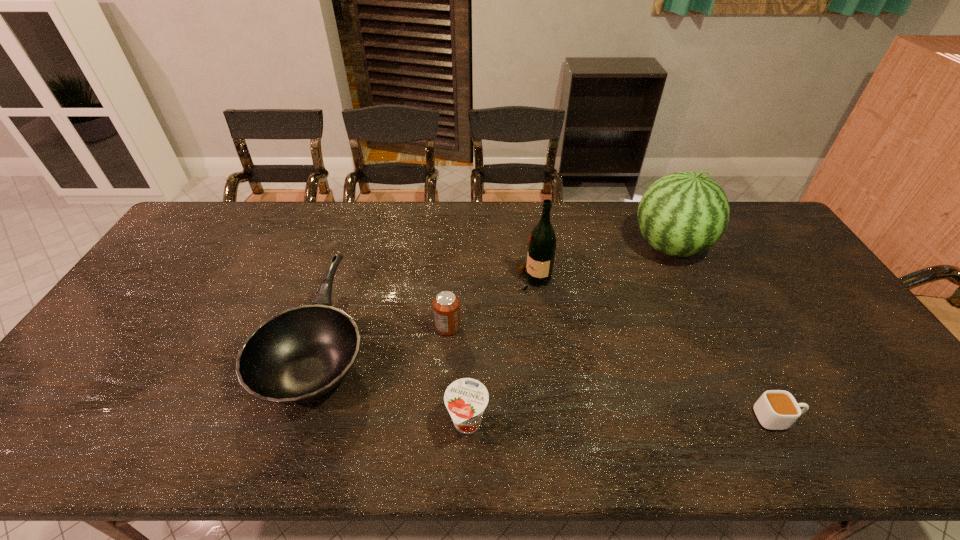
Where is `free space located on the front of the can`? This screenshot has width=960, height=540. free space located on the front of the can is located at coordinates (443, 403).

Locate an element on the screen. vacant space located on the left of the frying pan is located at coordinates (208, 341).

You are a GUI agent. You are given a task and a screenshot of the screen. Output one action in this format:
    pyautogui.click(x=<x>, y=<y>)
    Task: Click on the blank space located 0.140m on the back of the yogurt
    The image size is (960, 540).
    Given the screenshot: What is the action you would take?
    pyautogui.click(x=468, y=355)

The height and width of the screenshot is (540, 960). Find the location of `vacant space located on the side with the handle of the shortest object`. vacant space located on the side with the handle of the shortest object is located at coordinates (924, 418).

This screenshot has height=540, width=960. I want to click on object that is at the far edge, so click(681, 214).

Locate an element on the screen. This screenshot has height=540, width=960. frying pan that is at the near edge is located at coordinates (298, 355).

Where is `yogurt that is positioned at the near edge`? The width and height of the screenshot is (960, 540). yogurt that is positioned at the near edge is located at coordinates (465, 399).

This screenshot has height=540, width=960. Find the location of `cup that is at the near edge`. cup that is at the near edge is located at coordinates (776, 409).

This screenshot has width=960, height=540. Find the location of `vacant space at the far edge of the desktop`. vacant space at the far edge of the desktop is located at coordinates (562, 219).

The image size is (960, 540). In order to click on vacant point at the near edge in this screenshot , I will do `click(835, 457)`.